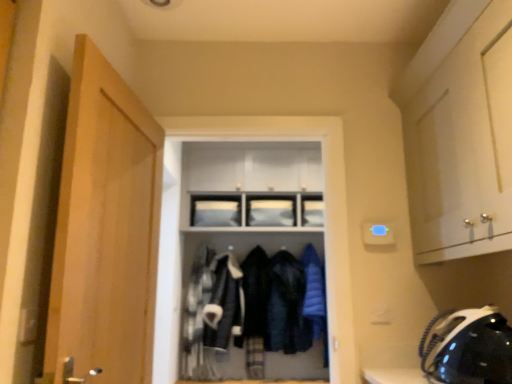
Question: Looking at the image, does matte black coat rack at center seem bigger or smaller compared to blue down jacket at center?

Choices:
 (A) small
 (B) big

Answer: (B)

Question: Visually, is matte black coat rack at center positioned to the left or to the right of blue down jacket at center?

Choices:
 (A) left
 (B) right

Answer: (A)

Question: Based on their relative distances, which object is farther from the matte black coat rack at center?

Choices:
 (A) wooden door at left
 (B) blue down jacket at center
 (C) velvet-like black coat at center, acting as the 1th clothing starting from the left
 (D) velvet-like black coat at center, arranged as the second clothing when viewed from the left
 (E) black matte helmet at lower right

Answer: (E)

Question: Which object is positioned farthest from the velvet-like black coat at center, placed as the second clothing when sorted from right to left?

Choices:
 (A) velvet-like black coat at center, which is the 3th clothing from right to left
 (B) black matte helmet at lower right
 (C) wooden door at left
 (D) matte black coat rack at center
 (E) blue down jacket at center

Answer: (C)